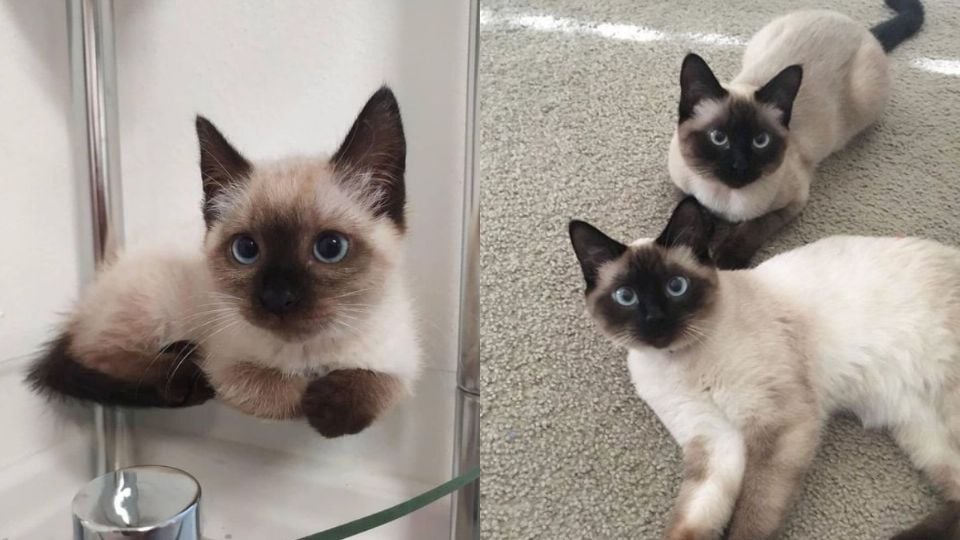
The image size is (960, 540). Identify the location of carpet. (524, 138).